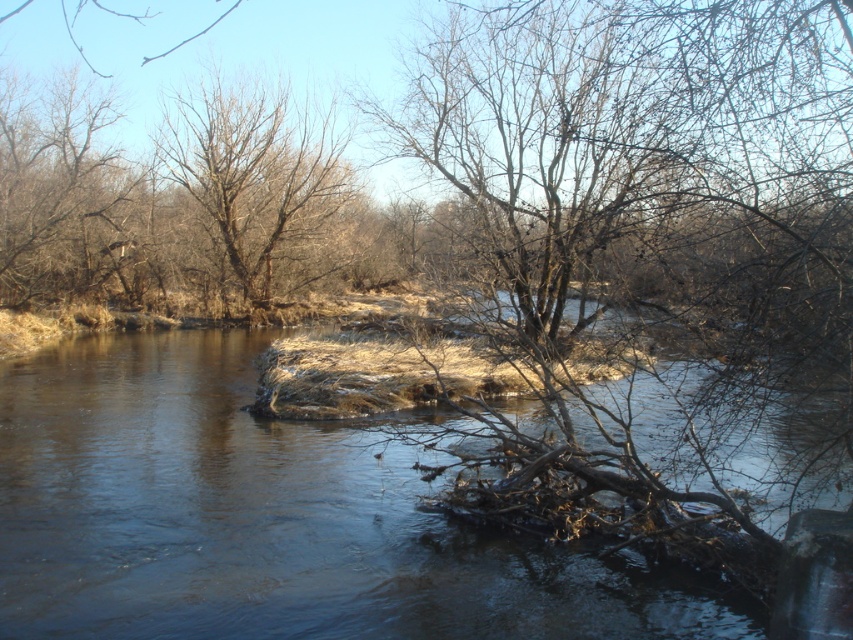
Is point (285, 477) closer to camera compared to point (285, 157)?

Yes, it is in front of point (285, 157).

Can you confirm if clear water at center is wider than brown/dry wood tree at center?

Correct, the width of clear water at center exceeds that of brown/dry wood tree at center.

Is point (518, 548) closer to camera compared to point (218, 124)?

Yes, point (518, 548) is closer to viewer.

Image resolution: width=853 pixels, height=640 pixels. Find the location of `clear water at center`. clear water at center is located at coordinates (267, 518).